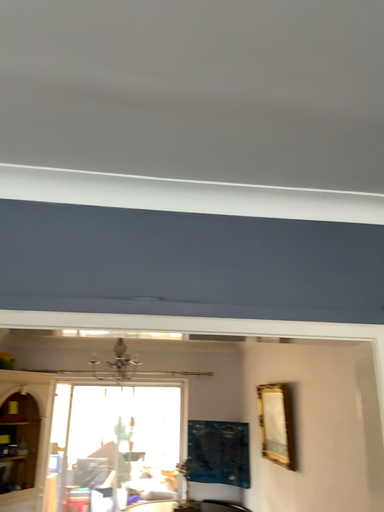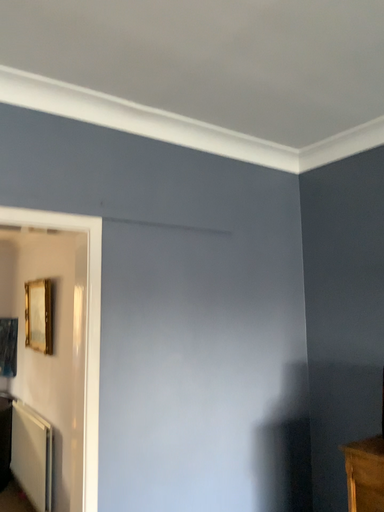
Question: How did the camera likely rotate when shooting the video?

Choices:
 (A) rotated right
 (B) rotated left

Answer: (A)